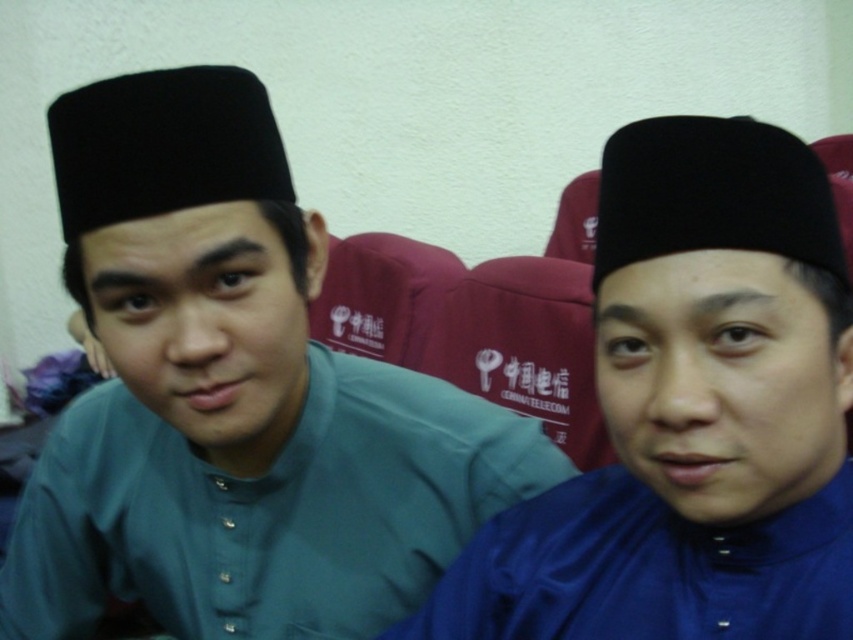
Question: Observing the image, what is the correct spatial positioning of matte green shirt at center in reference to black matte hat at upper left?

Choices:
 (A) left
 (B) right

Answer: (B)

Question: Which of these objects is positioned closest to the blue satin hat at center?

Choices:
 (A) blue satin robe at right
 (B) black matte hat at upper left

Answer: (A)

Question: Is blue satin robe at right further to camera compared to black matte hat at upper left?

Choices:
 (A) yes
 (B) no

Answer: (B)

Question: Among these points, which one is farthest from the camera?

Choices:
 (A) (532, 436)
 (B) (766, 204)
 (C) (544, 506)

Answer: (A)

Question: Based on their relative distances, which object is farther from the blue satin robe at right?

Choices:
 (A) matte green shirt at center
 (B) blue satin hat at center

Answer: (A)

Question: Does matte green shirt at center appear under blue satin hat at center?

Choices:
 (A) yes
 (B) no

Answer: (B)